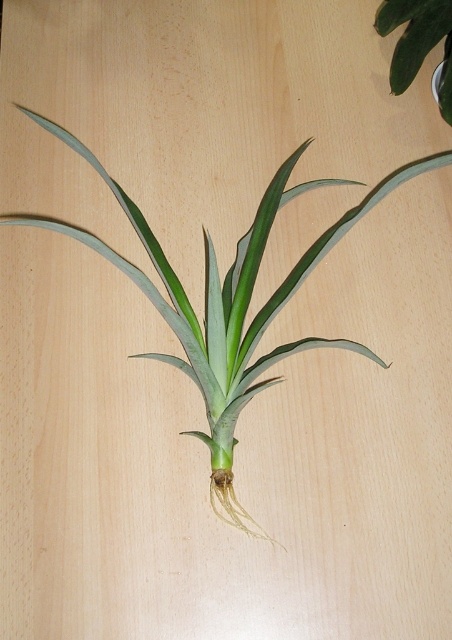
Is green leafy plant at center bigger than green leafy plant at upper right?

Yes, green leafy plant at center is bigger than green leafy plant at upper right.

Which is more to the right, green leafy plant at center or green leafy plant at upper right?

From the viewer's perspective, green leafy plant at upper right appears more on the right side.

The width and height of the screenshot is (452, 640). What are the coordinates of `green leafy plant at center` in the screenshot? It's located at (227, 301).

The height and width of the screenshot is (640, 452). I want to click on green leafy plant at center, so click(227, 301).